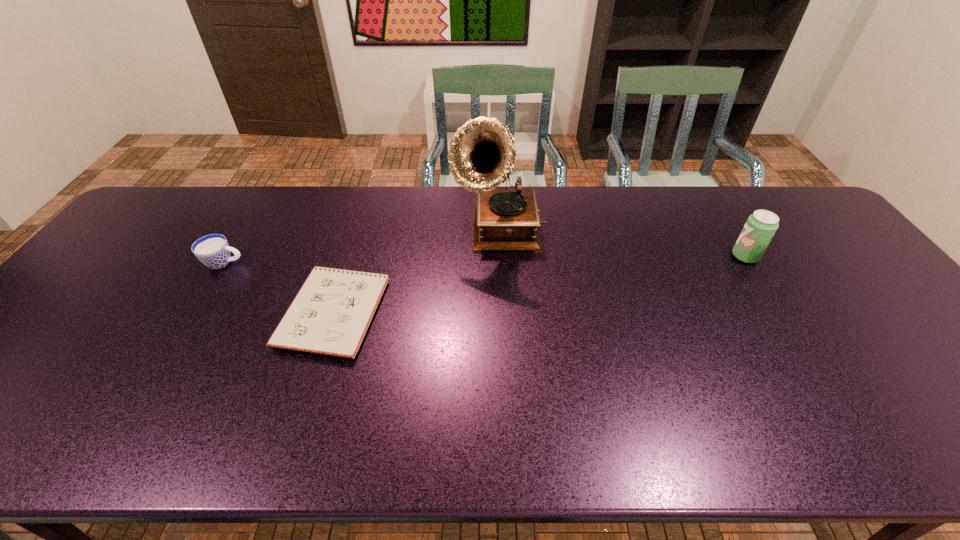
Locate an element on the screen. The image size is (960, 540). free space located 0.280m on the side of the second shortest object with the handle is located at coordinates (341, 262).

Where is `free space located on the left of the third object from right to left`? free space located on the left of the third object from right to left is located at coordinates (216, 310).

Find the location of a particular element. The image size is (960, 540). object that is at the far edge is located at coordinates (481, 156).

Locate an element on the screen. The height and width of the screenshot is (540, 960). blank space at the far edge of the desktop is located at coordinates (375, 194).

In the image, there is a desktop. Where is `free space at the near edge`? free space at the near edge is located at coordinates (578, 444).

At what (x,y) coordinates should I click in order to perform the action: click on vacant space at the left edge. Please return your answer as a coordinate pair (x, y). The image size is (960, 540). Looking at the image, I should click on (56, 328).

In the image, there is a desktop. Find the location of `vacant space at the right edge`. vacant space at the right edge is located at coordinates (850, 262).

In the image, there is a desktop. At what (x,y) coordinates should I click in order to perform the action: click on vacant space at the far left corner. Please return your answer as a coordinate pair (x, y). Image resolution: width=960 pixels, height=540 pixels. Looking at the image, I should click on (180, 218).

Where is `blank region between the second shortest object and the second tallest object`? The width and height of the screenshot is (960, 540). blank region between the second shortest object and the second tallest object is located at coordinates (485, 259).

Identify the location of blank region between the notepad and the soda. This screenshot has height=540, width=960. (540, 283).